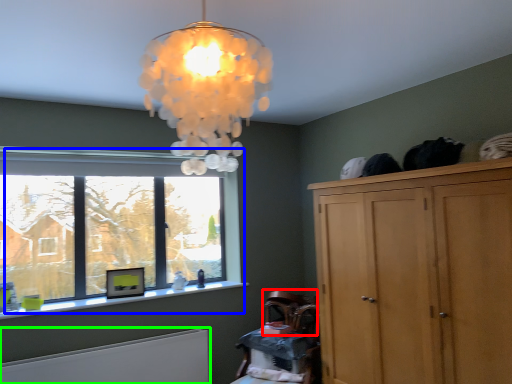
Question: Which object is positioned farthest from armchair (highlighted by a red box)? Select from window (highlighted by a blue box) and radiator (highlighted by a green box).

Choices:
 (A) window
 (B) radiator

Answer: (A)